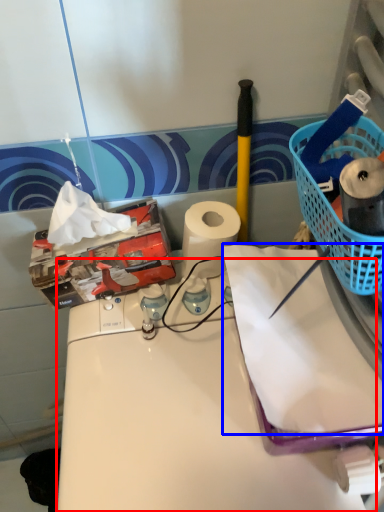
Question: Which object is further to the camera taking this photo, counter (highlighted by a red box) or paper (highlighted by a blue box)?

Choices:
 (A) counter
 (B) paper

Answer: (B)